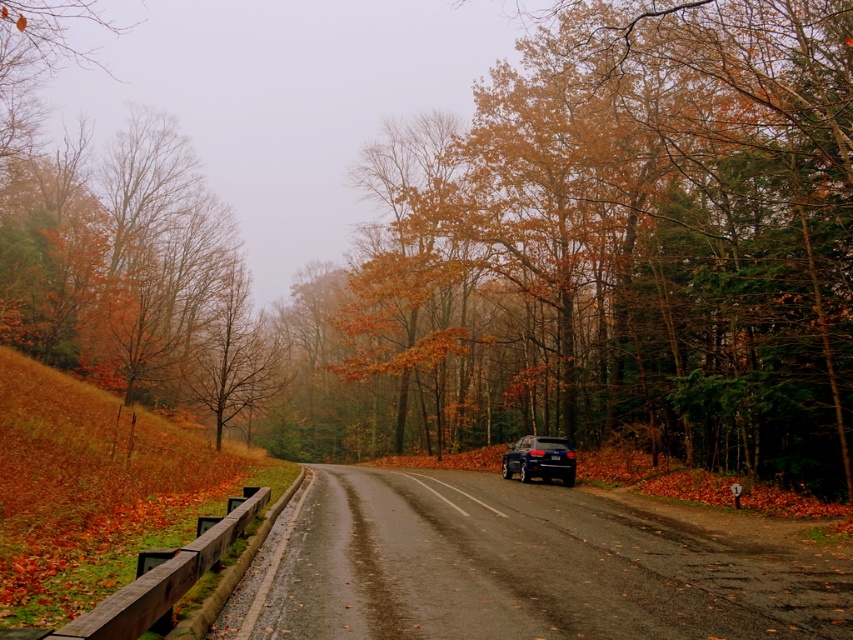
You are a photographer planning to capture the glossy black suv at center and the orange leafy tree at center in a single frame. Which object should you position closer to the foreground to ensure both are visible in the shot?

The orange leafy tree at center is taller than the glossy black suv at center. To ensure both are visible in the frame, position the glossy black suv at center closer to the foreground so its smaller size can still be seen alongside the taller tree.

You are standing at the center of the road and want to pick up an orange leafy tree at center. Which direction should you walk to reach it?

The orange leafy tree at center is located at point coordinates of [642,241]. Since you are standing at the center of the road, you should walk towards the center of the road where the orange leafy tree at center is positioned.